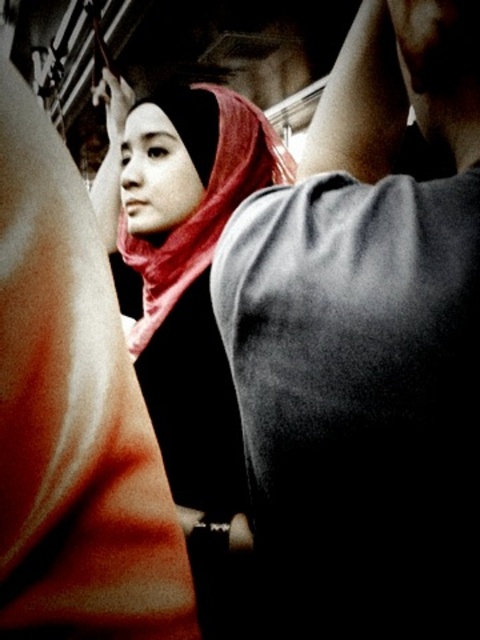
Question: Which object is farther from the camera taking this photo?

Choices:
 (A) gray matte shirt at upper right
 (B) matte red scarf at center

Answer: (B)

Question: Among these objects, which one is farthest from the camera?

Choices:
 (A) gray matte shirt at upper right
 (B) matte red scarf at center

Answer: (B)

Question: Is gray matte shirt at upper right to the right of matte red scarf at center from the viewer's perspective?

Choices:
 (A) no
 (B) yes

Answer: (B)

Question: From the image, what is the correct spatial relationship of gray matte shirt at upper right in relation to matte red scarf at center?

Choices:
 (A) right
 (B) left

Answer: (A)

Question: From the image, what is the correct spatial relationship of gray matte shirt at upper right in relation to matte red scarf at center?

Choices:
 (A) below
 (B) above

Answer: (A)